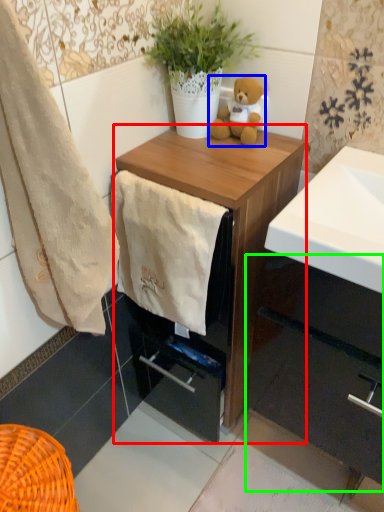
Question: Which is nearer to the chest of drawers (highlighted by a red box)? teddy bear (highlighted by a blue box) or cabinetry (highlighted by a green box).

Choices:
 (A) teddy bear
 (B) cabinetry

Answer: (A)